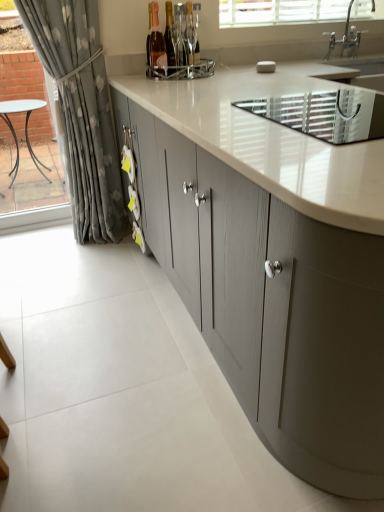
Question: Is matte gray cabinets at center at the left side of white textured blinds at upper center?

Choices:
 (A) no
 (B) yes

Answer: (B)

Question: Is matte gray cabinets at center bigger than white textured blinds at upper center?

Choices:
 (A) yes
 (B) no

Answer: (A)

Question: Is matte gray cabinets at center closer to the viewer compared to white textured blinds at upper center?

Choices:
 (A) no
 (B) yes

Answer: (B)

Question: Can you confirm if matte gray cabinets at center is taller than white textured blinds at upper center?

Choices:
 (A) no
 (B) yes

Answer: (B)

Question: Is matte gray cabinets at center smaller than white textured blinds at upper center?

Choices:
 (A) yes
 (B) no

Answer: (B)

Question: Is gray floral fabric curtain at left taller or shorter than matte glass bottle at center, which is the 1th bottle in right-to-left order?

Choices:
 (A) short
 (B) tall

Answer: (B)

Question: Is gray floral fabric curtain at left spatially inside matte glass bottle at center, which is the 1th bottle in right-to-left order, or outside of it?

Choices:
 (A) outside
 (B) inside

Answer: (A)

Question: From the image's perspective, is gray floral fabric curtain at left located above or below matte glass bottle at center, which is the third bottle from left to right?

Choices:
 (A) below
 (B) above

Answer: (A)

Question: Is gray floral fabric curtain at left in front of or behind matte glass bottle at center, which is the 1th bottle in right-to-left order, in the image?

Choices:
 (A) front
 (B) behind

Answer: (A)

Question: Considering the positions of point (289, 429) and point (155, 74), is point (289, 429) closer or farther from the camera than point (155, 74)?

Choices:
 (A) farther
 (B) closer

Answer: (B)

Question: Considering the positions of matte gray cabinets at center and pink glass bottle at upper center, placed as the 1th bottle when sorted from left to right, in the image, is matte gray cabinets at center taller or shorter than pink glass bottle at upper center, placed as the 1th bottle when sorted from left to right,?

Choices:
 (A) tall
 (B) short

Answer: (A)

Question: Looking at their shapes, would you say matte gray cabinets at center is wider or thinner than pink glass bottle at upper center, placed as the 1th bottle when sorted from left to right?

Choices:
 (A) wide
 (B) thin

Answer: (A)

Question: Would you say matte gray cabinets at center is to the left or to the right of pink glass bottle at upper center, placed as the 1th bottle when sorted from left to right, in the picture?

Choices:
 (A) right
 (B) left

Answer: (A)

Question: Considering the positions of white textured blinds at upper center and pink glass bottle at upper center, placed as the 1th bottle when sorted from left to right, in the image, is white textured blinds at upper center taller or shorter than pink glass bottle at upper center, placed as the 1th bottle when sorted from left to right,?

Choices:
 (A) short
 (B) tall

Answer: (A)

Question: Would you say white textured blinds at upper center is to the left or to the right of pink glass bottle at upper center, which is counted as the third bottle, starting from the right, in the picture?

Choices:
 (A) left
 (B) right

Answer: (B)